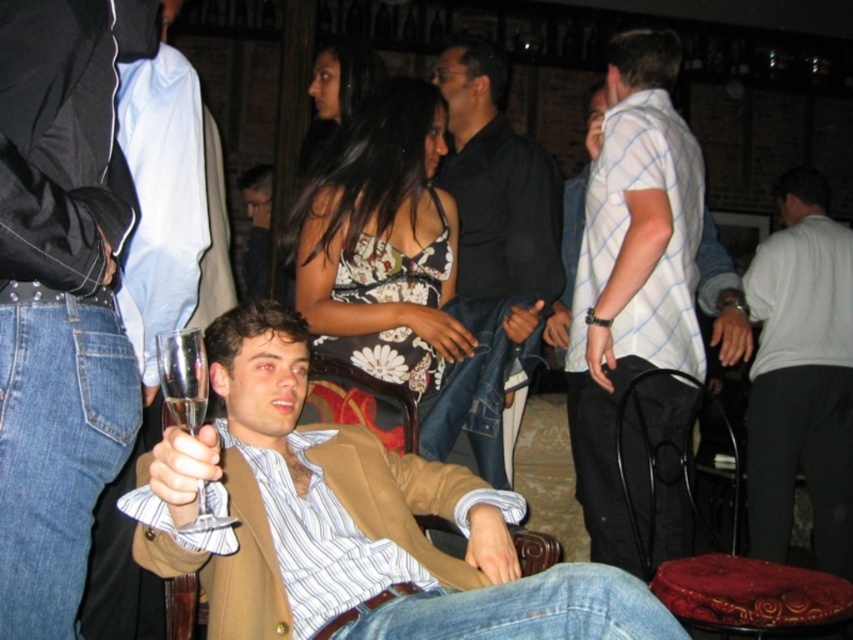
Question: Does black smooth shirt at center have a smaller size compared to dark brown hair at upper center?

Choices:
 (A) yes
 (B) no

Answer: (B)

Question: Which object is farther from the camera taking this photo?

Choices:
 (A) clear glass wine glass at center
 (B) matte brown blazer at center

Answer: (B)

Question: Which point is farther to the camera?

Choices:
 (A) matte brown blazer at center
 (B) clear glass wine glass at center
 (C) dark brown hair at upper center
 (D) white matte shirt at right

Answer: (D)

Question: Can you confirm if matte brown blazer at center is bigger than light brown leather jacket at center?

Choices:
 (A) yes
 (B) no

Answer: (A)

Question: Among these objects, which one is farthest from the camera?

Choices:
 (A) white checkered shirt at center
 (B) black smooth shirt at center
 (C) white matte shirt at right

Answer: (C)

Question: Observing the image, what is the correct spatial positioning of light brown leather jacket at center in reference to clear glass wine glass at center?

Choices:
 (A) above
 (B) below

Answer: (A)